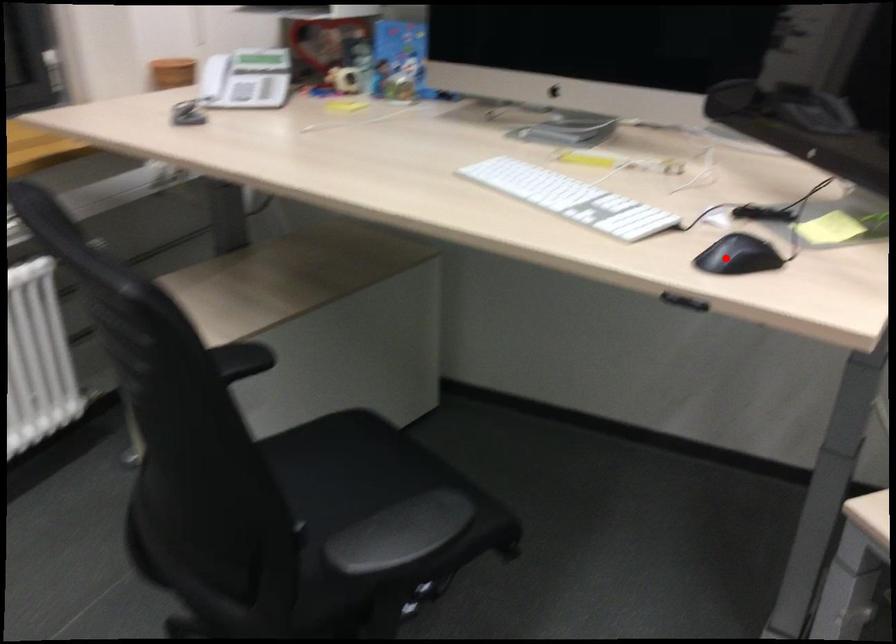
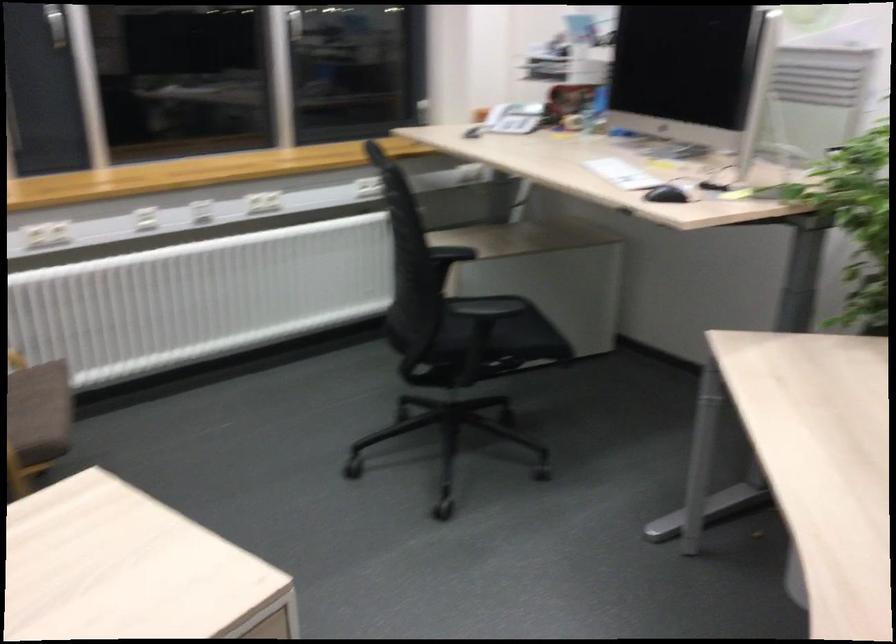
Question: I am providing you with two images of the same scene from different viewpoints. A red point is shown in image1. For the corresponding object point in image2, is it positioned nearer or farther from the camera?

Choices:
 (A) Nearer
 (B) Farther

Answer: (B)